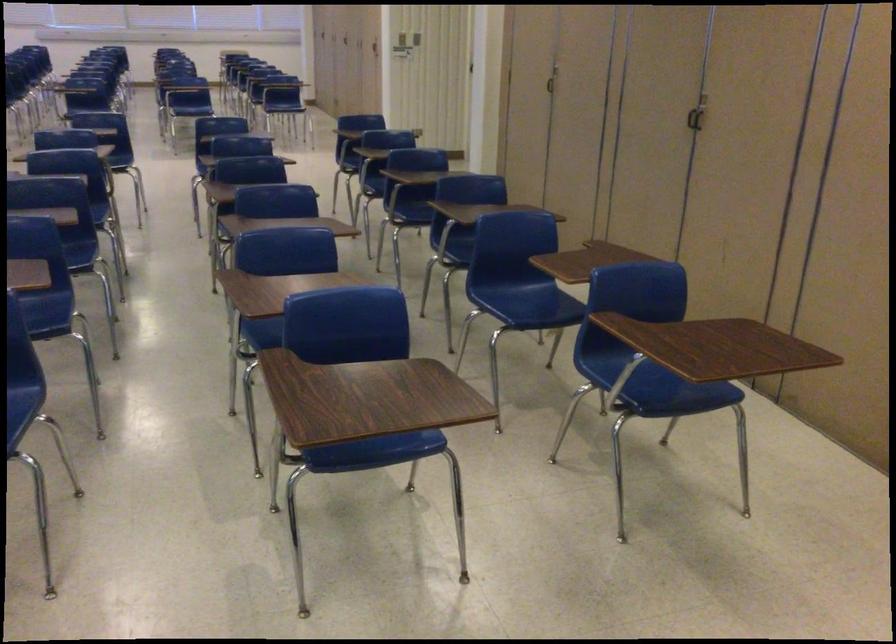
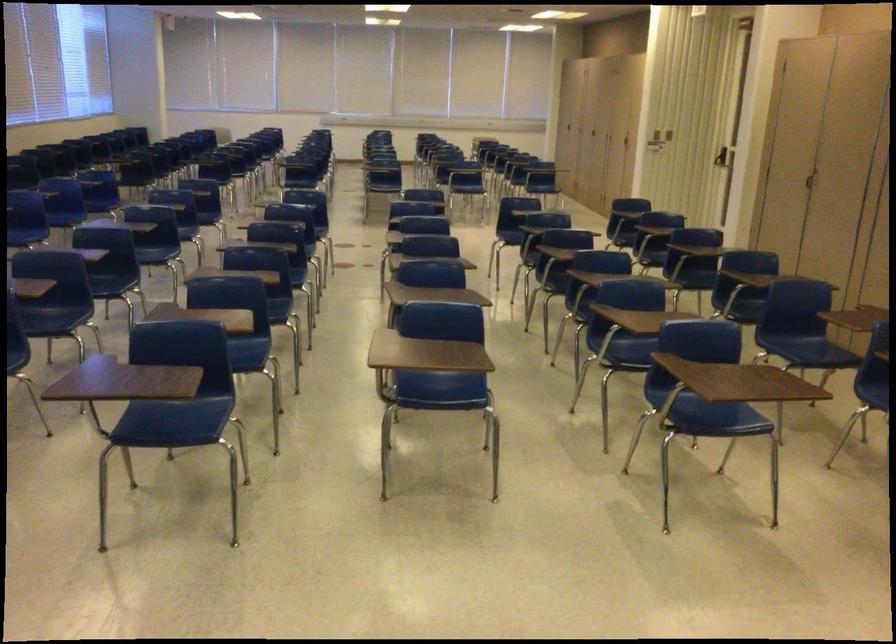
Where in the second image is the point corresponding to point 547,91 from the first image?

(808, 180)